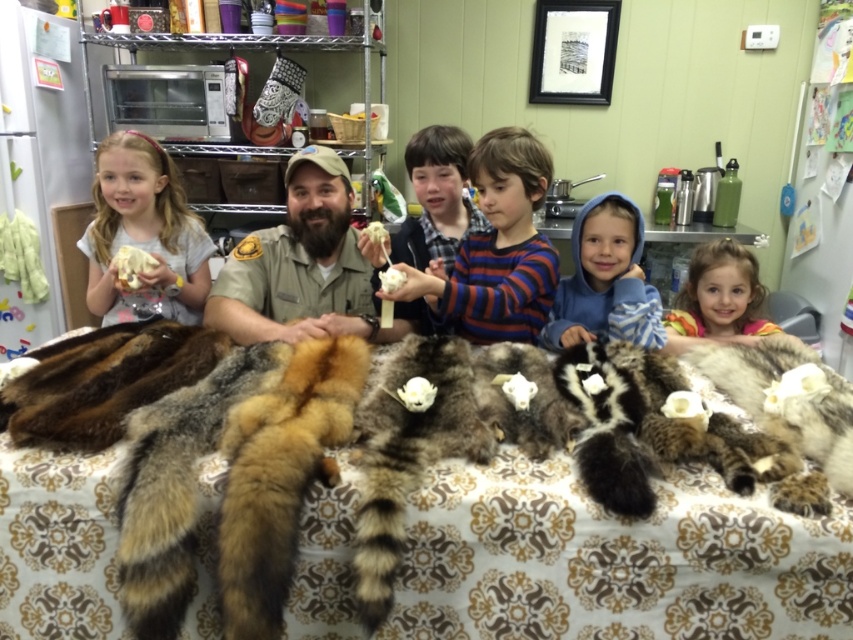
Is point (547, 300) behind point (537, 192)?

Yes.

Is striped cotton shirt at center thinner than brown fur coat at center?

Indeed, striped cotton shirt at center has a lesser width compared to brown fur coat at center.

Which is behind, point (529, 269) or point (538, 188)?

The point (538, 188) is behind.

This screenshot has height=640, width=853. I want to click on striped cotton shirt at center, so click(x=496, y=248).

Which is more to the left, brown uniform at center or blue fleece hoodie at center?

Positioned to the left is brown uniform at center.

Which is in front, point (273, 321) or point (635, 333)?

Point (635, 333)

Locate an element on the screen. brown uniform at center is located at coordinates (300, 266).

Who is more distant from viewer, (496, 300) or (369, 236)?

Point (369, 236)

Can you confirm if striped cotton shirt at center is positioned below white fluffy cotton at center?

No.

Locate an element on the screen. striped cotton shirt at center is located at coordinates (496, 248).

Locate an element on the screen. striped cotton shirt at center is located at coordinates (496, 248).